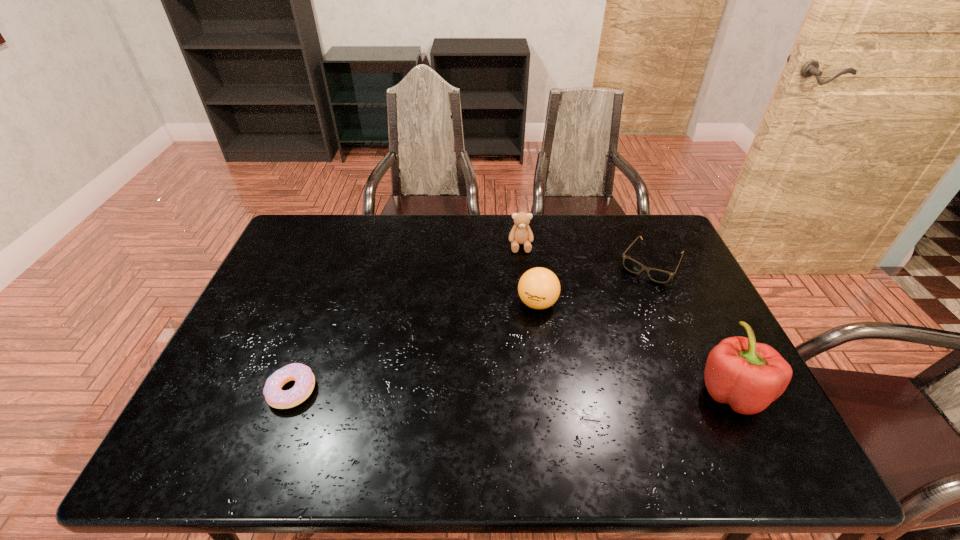
In order to click on vacant space at the far right corner of the desktop in this screenshot , I will do `click(626, 222)`.

This screenshot has width=960, height=540. I want to click on empty space that is in between the sunglasses and the teddy bear, so [586, 254].

Identify the location of free area in between the tallest object and the sunglasses. The image size is (960, 540). (691, 327).

Where is `free space between the teddy bear and the doughnut`? The width and height of the screenshot is (960, 540). free space between the teddy bear and the doughnut is located at coordinates (406, 318).

The image size is (960, 540). Find the location of `vacant area that lies between the bell pepper and the teddy bear`. vacant area that lies between the bell pepper and the teddy bear is located at coordinates (626, 318).

The image size is (960, 540). Identify the location of vacant space that is in between the leftmost object and the teddy bear. (406, 318).

This screenshot has height=540, width=960. In order to click on vacant area that lies between the teddy bear and the doughnut in this screenshot , I will do (406, 318).

Identify the location of vacant space in between the sunglasses and the bell pepper. This screenshot has height=540, width=960. (691, 327).

You are a GUI agent. You are given a task and a screenshot of the screen. Output one action in this format:
    pyautogui.click(x=<x>, y=<y>)
    Task: Click on the free space between the bell pepper and the teddy bear
    
    Given the screenshot: What is the action you would take?
    tap(626, 318)

You are a GUI agent. You are given a task and a screenshot of the screen. Output one action in this format:
    pyautogui.click(x=<x>, y=<y>)
    Task: Click on the free spot between the leftmost object and the ping-pong ball
    This screenshot has width=960, height=540.
    Given the screenshot: What is the action you would take?
    pyautogui.click(x=415, y=347)